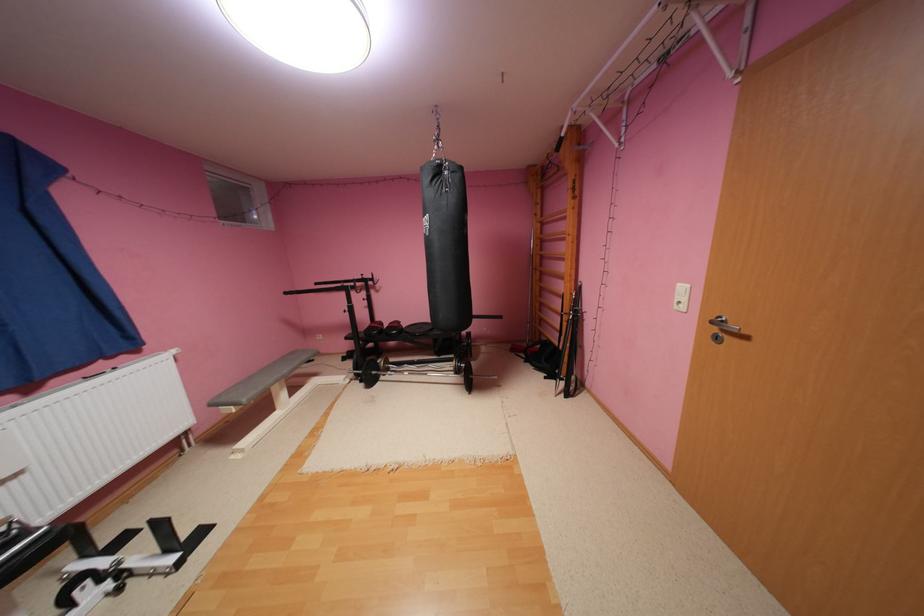
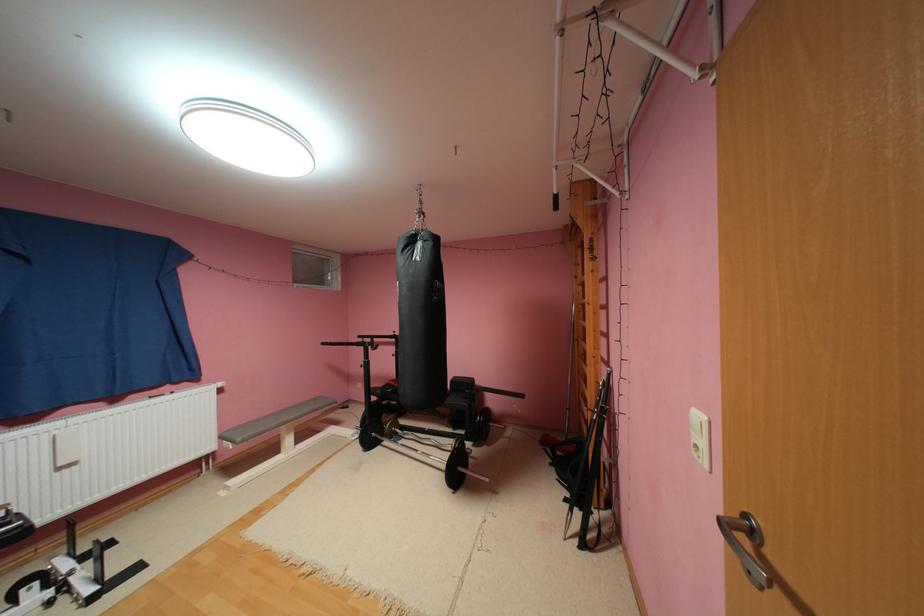
Where in the second image is the point corresponding to point 460,368 from the first image?

(458, 450)